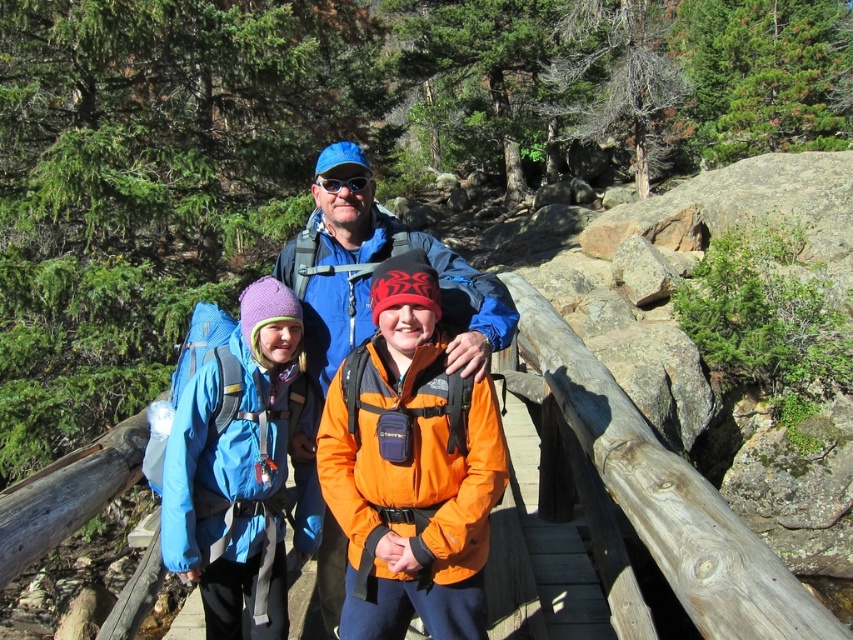
Question: Is blue fabric backpack at center above blue fabric jacket at center?

Choices:
 (A) yes
 (B) no

Answer: (B)

Question: Which object appears closest to the camera in this image?

Choices:
 (A) blue fabric jacket at center
 (B) blue fabric backpack at center

Answer: (A)

Question: Which point is farther from the camera taking this photo?

Choices:
 (A) (345, 266)
 (B) (184, 570)

Answer: (A)

Question: Is blue fabric backpack at center positioned before blue fabric jacket at center?

Choices:
 (A) no
 (B) yes

Answer: (A)

Question: Which point is closer to the camera?

Choices:
 (A) (321, 230)
 (B) (257, 356)

Answer: (B)

Question: Can you confirm if blue fabric backpack at center is positioned below blue fabric jacket at center?

Choices:
 (A) no
 (B) yes

Answer: (B)